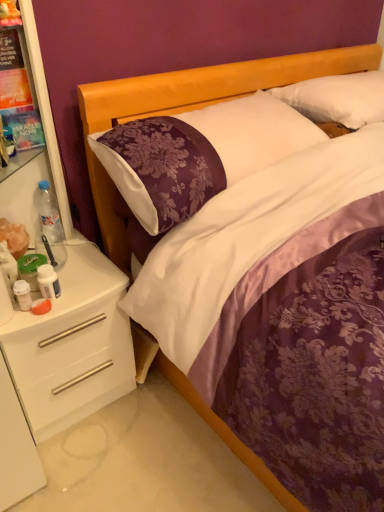
Find the location of `unoccupied region to the right of clear plastic bottle at left, the third bottle in the back-to-front sequence`. unoccupied region to the right of clear plastic bottle at left, the third bottle in the back-to-front sequence is located at coordinates (79, 296).